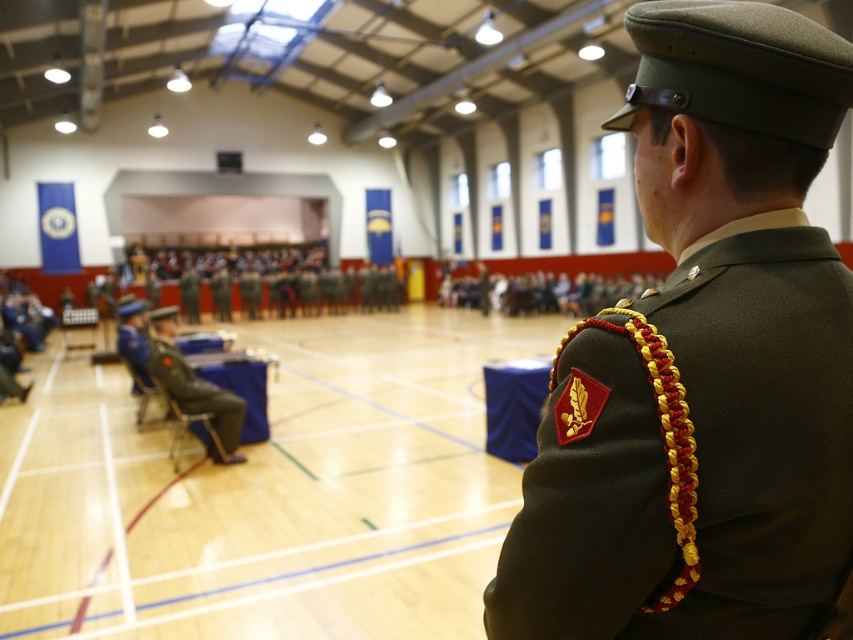
Question: Among these objects, which one is nearest to the camera?

Choices:
 (A) green military uniform at center
 (B) matte green uniform at center

Answer: (B)

Question: Can you confirm if matte green uniform at center is bigger than green military uniform at center?

Choices:
 (A) yes
 (B) no

Answer: (B)

Question: Does matte green uniform at center appear over green military uniform at center?

Choices:
 (A) no
 (B) yes

Answer: (B)

Question: Does matte green uniform at center appear on the right side of green military uniform at center?

Choices:
 (A) no
 (B) yes

Answer: (B)